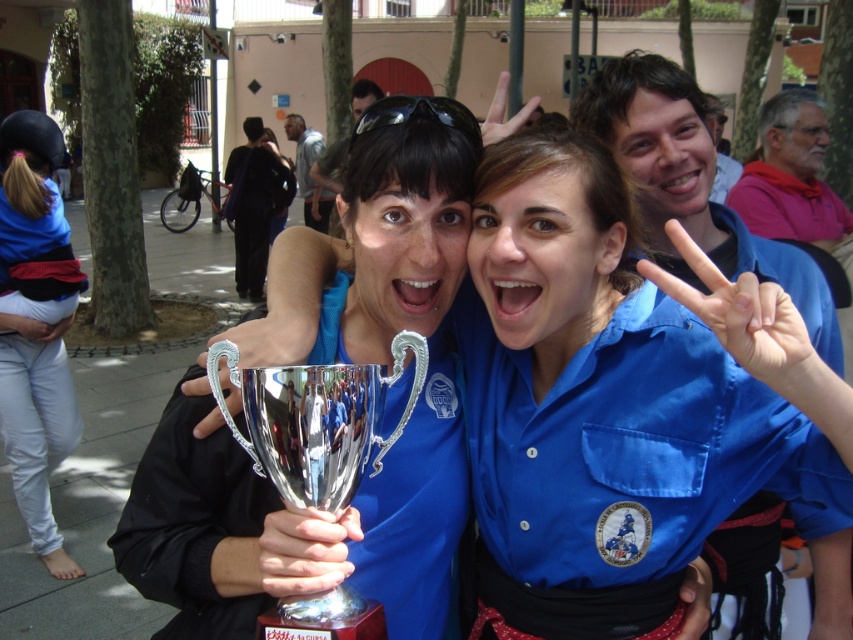
Question: Which point is closer to the camera?

Choices:
 (A) (517, 259)
 (B) (35, 152)

Answer: (A)

Question: Observing the image, what is the correct spatial positioning of metallic trophy at center in reference to blue denim pants at lower left?

Choices:
 (A) below
 (B) above

Answer: (A)

Question: Estimate the real-world distances between objects in this image. Which object is farther from the silver shiny trophy at center?

Choices:
 (A) metallic trophy at center
 (B) black fabric jacket at center

Answer: (B)

Question: Considering the relative positions of metallic trophy at center and silver shiny trophy at center in the image provided, where is metallic trophy at center located with respect to silver shiny trophy at center?

Choices:
 (A) right
 (B) left

Answer: (A)

Question: Which point appears closest to the camera in this image?

Choices:
 (A) (704, 314)
 (B) (4, 400)

Answer: (A)

Question: Does silver shiny trophy at center come in front of black fabric jacket at center?

Choices:
 (A) no
 (B) yes

Answer: (B)